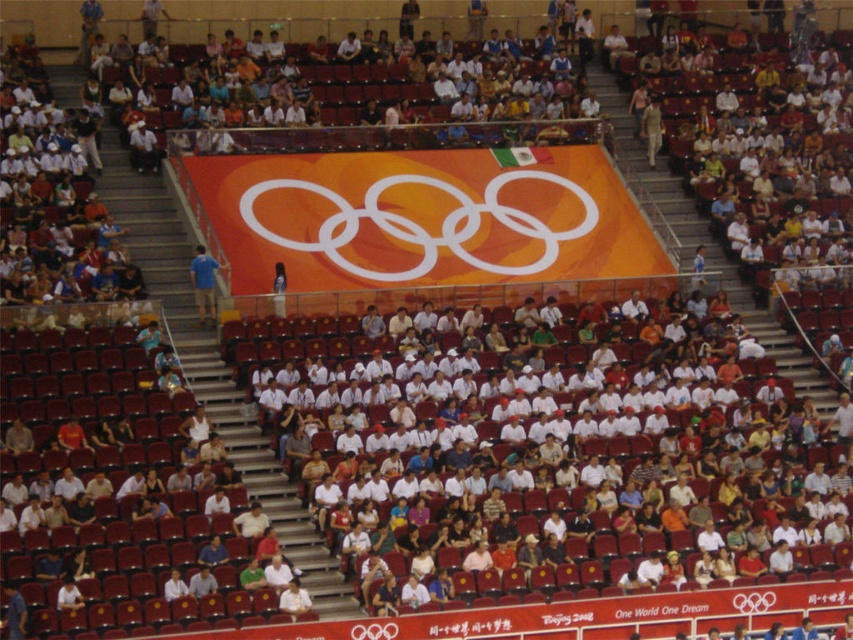
Question: Does blue fabric shirt at center appear on the right side of light brown leather jacket at upper right?

Choices:
 (A) no
 (B) yes

Answer: (A)

Question: Which point is closer to the camera?

Choices:
 (A) (212, 292)
 (B) (654, 120)

Answer: (A)

Question: Is blue fabric shirt at center positioned at the back of light brown leather jacket at upper right?

Choices:
 (A) yes
 (B) no

Answer: (B)

Question: Among these points, which one is nearest to the camera?

Choices:
 (A) (650, 125)
 (B) (198, 275)

Answer: (B)

Question: Does blue fabric shirt at center have a smaller size compared to light brown leather jacket at upper right?

Choices:
 (A) yes
 (B) no

Answer: (B)